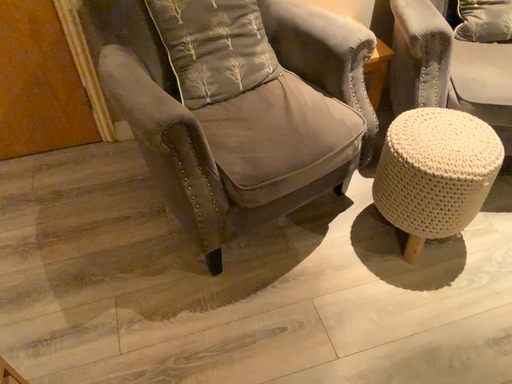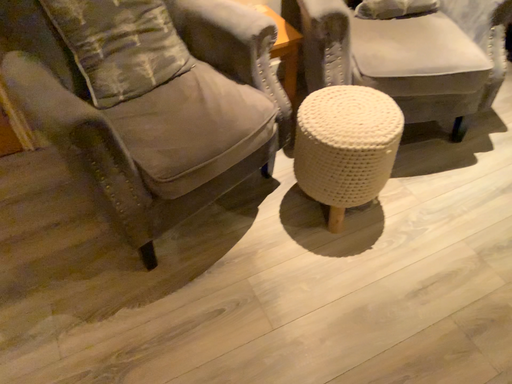
Question: Which way did the camera rotate in the video?

Choices:
 (A) rotated left
 (B) rotated right

Answer: (B)